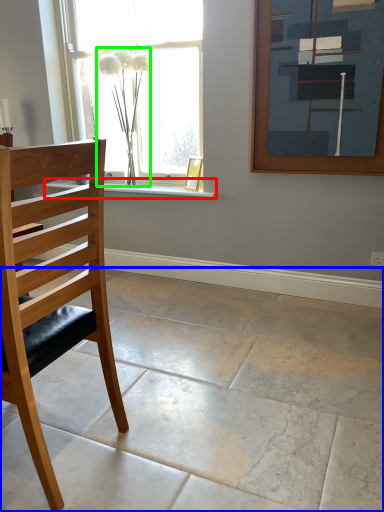
Question: Which object is the farthest from window sill (highlighted by a red box)? Choose among these: concrete (highlighted by a blue box) or plant (highlighted by a green box).

Choices:
 (A) concrete
 (B) plant

Answer: (A)